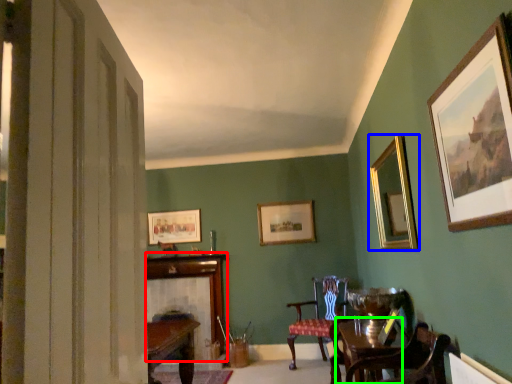
Question: Which object is the closest to the fireplace (highlighted by a red box)? Choose among these: picture frame (highlighted by a blue box) or round table (highlighted by a green box).

Choices:
 (A) picture frame
 (B) round table

Answer: (B)